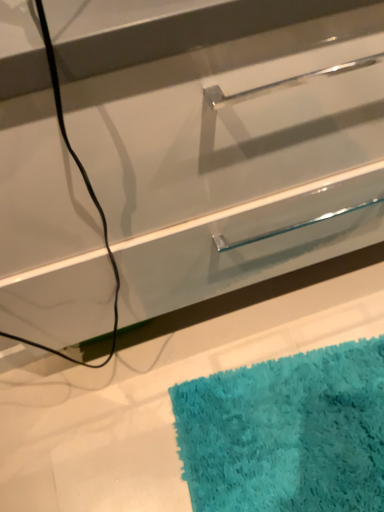
Question: Would you say turquoise shaggy bath mat at lower right contains clear glass drawer at center?

Choices:
 (A) no
 (B) yes

Answer: (A)

Question: Could you tell me if turquoise shaggy bath mat at lower right is turned towards clear glass drawer at center?

Choices:
 (A) yes
 (B) no

Answer: (B)

Question: Is turquoise shaggy bath mat at lower right not near clear glass drawer at center?

Choices:
 (A) yes
 (B) no

Answer: (B)

Question: Does turquoise shaggy bath mat at lower right have a greater height compared to clear glass drawer at center?

Choices:
 (A) yes
 (B) no

Answer: (B)

Question: Is turquoise shaggy bath mat at lower right wider than clear glass drawer at center?

Choices:
 (A) yes
 (B) no

Answer: (A)

Question: From a real-world perspective, is turquoise shaggy bath mat at lower right physically below clear glass drawer at center?

Choices:
 (A) no
 (B) yes

Answer: (B)

Question: Does clear glass drawer at center have a smaller size compared to turquoise shaggy bath mat at lower right?

Choices:
 (A) yes
 (B) no

Answer: (B)

Question: From the image's perspective, would you say clear glass drawer at center is positioned over turquoise shaggy bath mat at lower right?

Choices:
 (A) no
 (B) yes

Answer: (B)

Question: Can you confirm if clear glass drawer at center is taller than turquoise shaggy bath mat at lower right?

Choices:
 (A) no
 (B) yes

Answer: (B)

Question: Is clear glass drawer at center shorter than turquoise shaggy bath mat at lower right?

Choices:
 (A) yes
 (B) no

Answer: (B)

Question: Does clear glass drawer at center contain turquoise shaggy bath mat at lower right?

Choices:
 (A) no
 (B) yes

Answer: (A)

Question: Is clear glass drawer at center in contact with turquoise shaggy bath mat at lower right?

Choices:
 (A) yes
 (B) no

Answer: (B)

Question: From their relative heights in the image, would you say clear glass drawer at center is taller or shorter than turquoise shaggy bath mat at lower right?

Choices:
 (A) short
 (B) tall

Answer: (B)